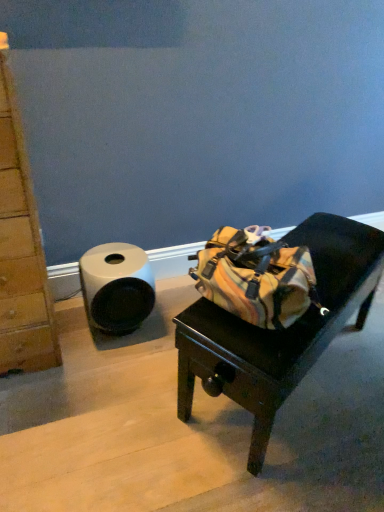
Identify the location of empty space that is ontop of white matte toilet paper at left (from a real-world perspective). (119, 253).